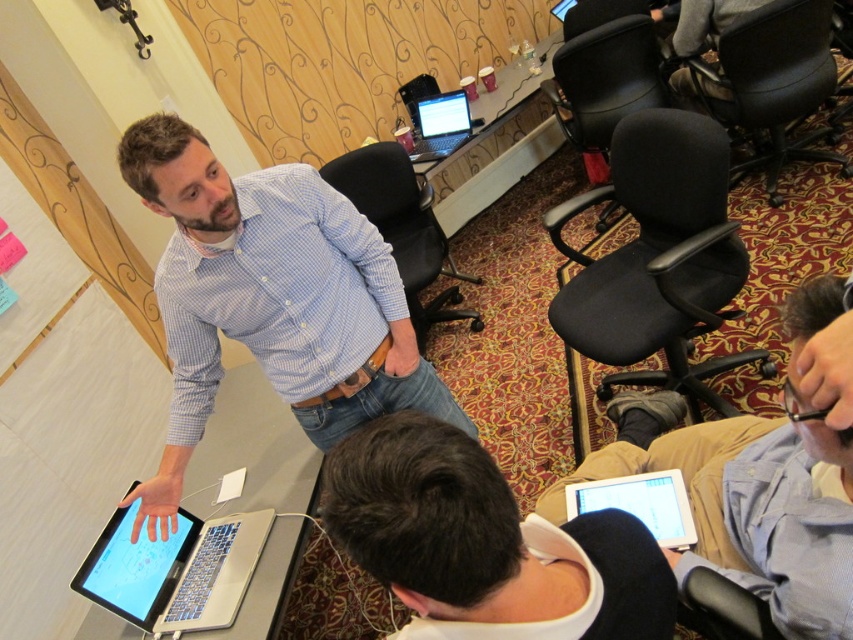
Question: Can you confirm if blue checkered shirt at center is positioned to the left of white matte tablet at lower center?

Choices:
 (A) yes
 (B) no

Answer: (A)

Question: Which object appears closest to the camera in this image?

Choices:
 (A) silver metallic laptop at upper center
 (B) silver metallic laptop at lower left

Answer: (B)

Question: Among these points, which one is farthest from the camera?

Choices:
 (A) (424, 588)
 (B) (428, 148)
 (C) (281, 228)
 (D) (442, 304)

Answer: (D)

Question: Which point is farther to the camera?

Choices:
 (A) (772, 504)
 (B) (375, 460)
 (C) (672, 486)

Answer: (C)

Question: Does blue shirt at upper center appear over black fabric chair at upper right?

Choices:
 (A) yes
 (B) no

Answer: (B)

Question: Is black leather chair at upper right positioned in front of silver metallic laptop at upper center?

Choices:
 (A) yes
 (B) no

Answer: (A)